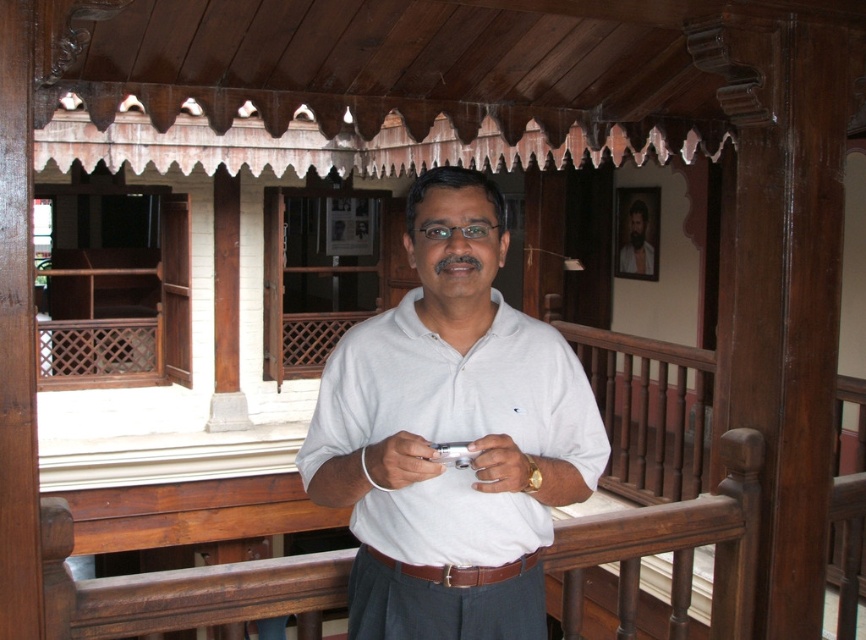
You are a photographer trying to capture a portrait of the bearded man at center and the white matte shirt at center. Which object should you focus on first if you want to ensure both are in sharp focus?

The white matte shirt at center might be wider than bearded man at center, so you should focus on the wider object first to maximize depth of field.

You are a photographer taking a portrait of the man. You notice the white matte shirt at center and the white matte wristband at center. Which object should you focus on first if you want to capture the one closer to the camera?

The white matte wristband at center is closer to the camera than the white matte shirt at center, so you should focus on the white matte wristband at center first.